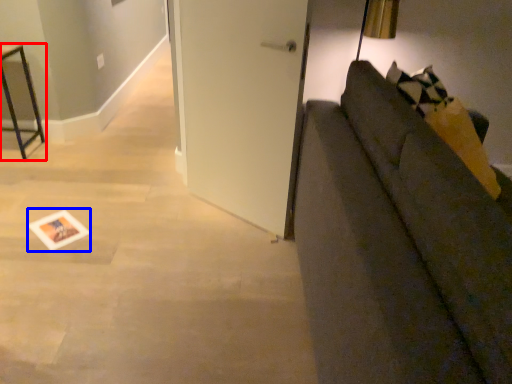
Question: Among these objects, which one is farthest to the camera, furniture (highlighted by a red box) or postcard (highlighted by a blue box)?

Choices:
 (A) furniture
 (B) postcard

Answer: (A)